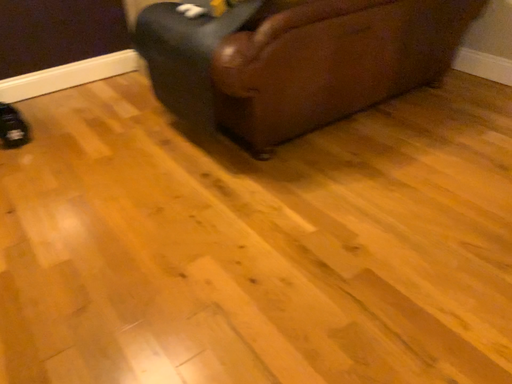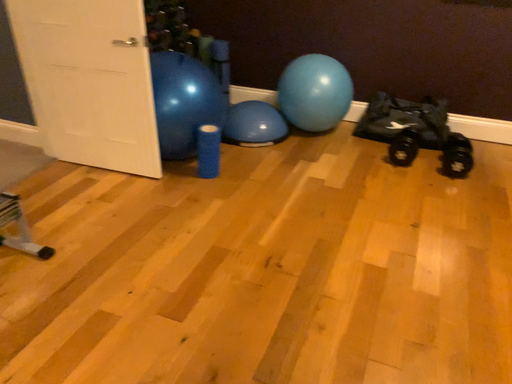
Question: How did the camera likely rotate when shooting the video?

Choices:
 (A) rotated left
 (B) rotated right

Answer: (A)